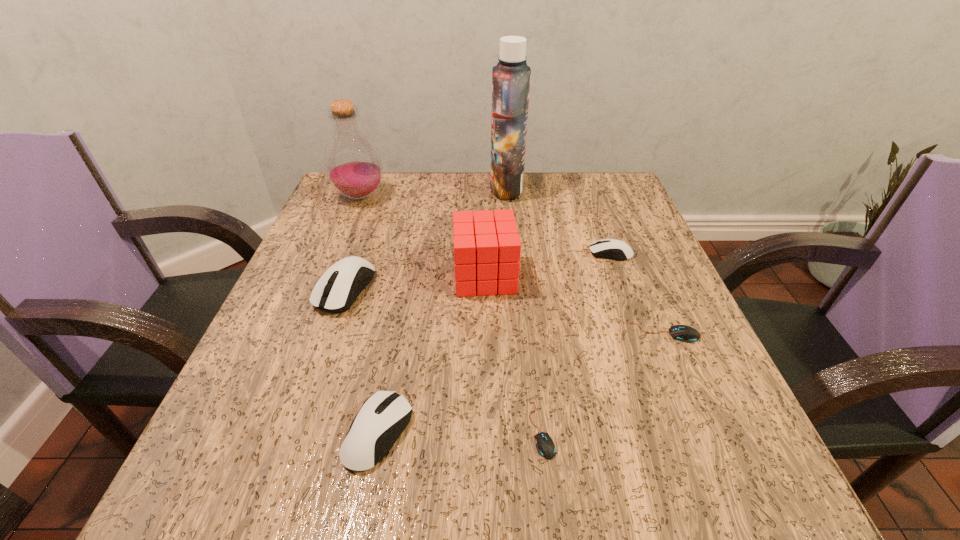
The image size is (960, 540). Find the location of `free space between the sixth farthest object and the farthest mouse`. free space between the sixth farthest object and the farthest mouse is located at coordinates coord(637,293).

Identify the location of vacant space that's between the seventh tallest object and the shampoo. The width and height of the screenshot is (960, 540). (586, 260).

At what (x,y) coordinates should I click in order to perform the action: click on vacant area that lies between the second biggest white mouse and the second farthest mouse. Please return your answer as a coordinate pair (x, y). This screenshot has height=540, width=960. Looking at the image, I should click on point(362,361).

This screenshot has width=960, height=540. In order to click on vacant space in between the third nearest mouse and the second farthest mouse in this screenshot , I will do `click(505, 311)`.

Point out which object is positioned as the third nearest to the second white mouse from right to left. Please provide its 2D coordinates. Your answer should be formatted as a tuple, i.e. [(x, y)], where the tuple contains the x and y coordinates of a point satisfying the conditions above.

[(487, 248)]

Select which object appears as the third closest to the bottle. Please provide its 2D coordinates. Your answer should be formatted as a tuple, i.e. [(x, y)], where the tuple contains the x and y coordinates of a point satisfying the conditions above.

[(511, 76)]

Point out which mouse is positioned as the third nearest to the tallest object. Please provide its 2D coordinates. Your answer should be formatted as a tuple, i.e. [(x, y)], where the tuple contains the x and y coordinates of a point satisfying the conditions above.

[(684, 333)]

At what (x,y) coordinates should I click in order to perform the action: click on the second closest mouse to the purple bottle. Please return your answer as a coordinate pair (x, y). The height and width of the screenshot is (540, 960). Looking at the image, I should click on coord(614,249).

The width and height of the screenshot is (960, 540). I want to click on the closest white mouse to the sixth tallest object, so click(x=333, y=292).

I want to click on white mouse that is the nearest to the farther black mouse, so click(x=614, y=249).